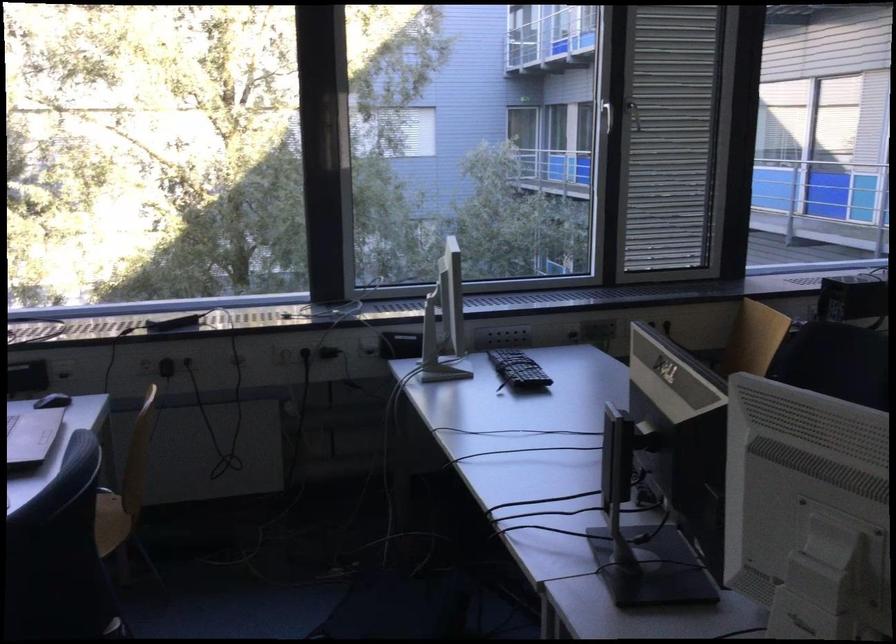
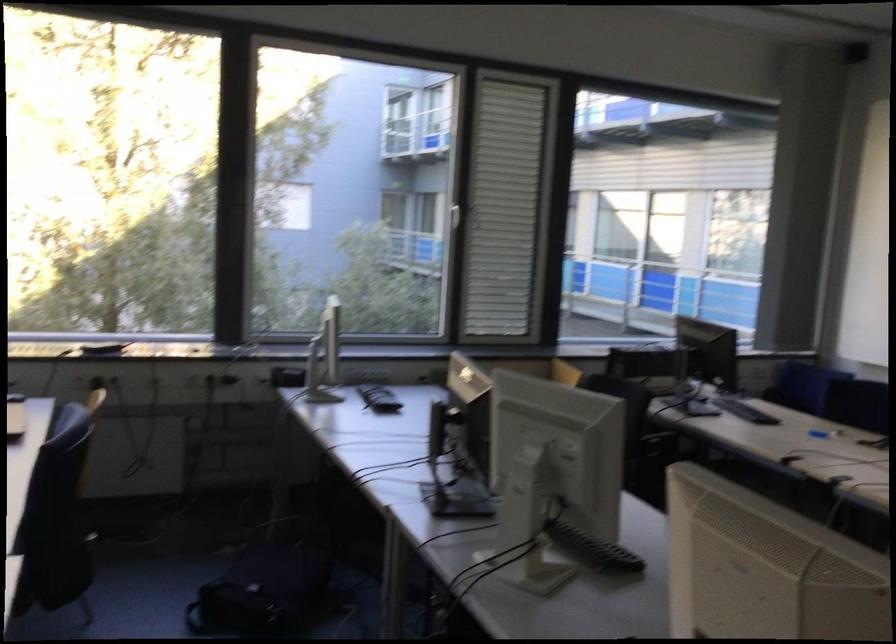
Locate, in the second image, the point that corresponds to point 607,133 in the first image.

(453, 216)